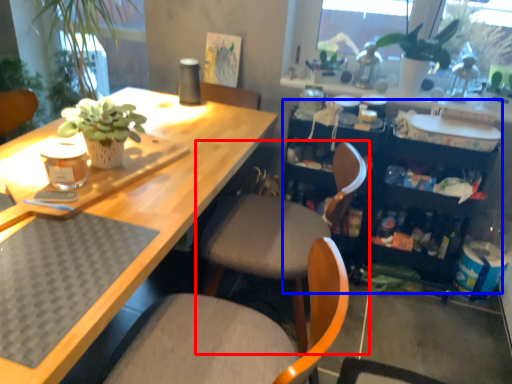
Question: Among these objects, which one is farthest to the camera, chair (highlighted by a red box) or bookshelf (highlighted by a blue box)?

Choices:
 (A) chair
 (B) bookshelf

Answer: (B)